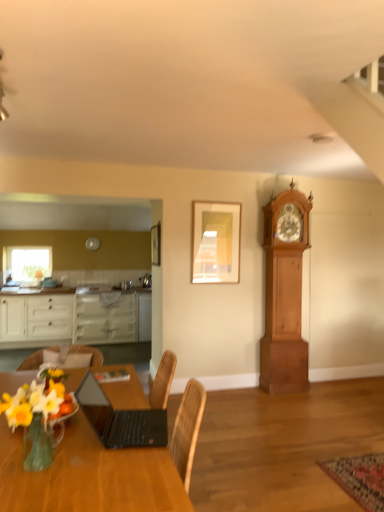
Question: Is matte gold picture frame at upper center, the second picture frame positioned from the left, at the right side of clear glass window at upper left?

Choices:
 (A) no
 (B) yes

Answer: (B)

Question: Does matte gold picture frame at upper center, arranged as the first picture frame when viewed from the right, have a smaller size compared to clear glass window at upper left?

Choices:
 (A) no
 (B) yes

Answer: (B)

Question: Can you confirm if matte gold picture frame at upper center, arranged as the first picture frame when viewed from the right, is bigger than clear glass window at upper left?

Choices:
 (A) no
 (B) yes

Answer: (A)

Question: Does matte gold picture frame at upper center, the second picture frame positioned from the left, have a greater height compared to clear glass window at upper left?

Choices:
 (A) yes
 (B) no

Answer: (A)

Question: Considering the relative positions of matte gold picture frame at upper center, arranged as the first picture frame when viewed from the right, and clear glass window at upper left in the image provided, is matte gold picture frame at upper center, arranged as the first picture frame when viewed from the right, in front of clear glass window at upper left?

Choices:
 (A) yes
 (B) no

Answer: (A)

Question: From a real-world perspective, is translucent glass vase at lower left physically located above or below wooden chair at lower left?

Choices:
 (A) below
 (B) above

Answer: (B)

Question: Is point (18, 394) positioned closer to the camera than point (26, 366)?

Choices:
 (A) closer
 (B) farther

Answer: (A)

Question: From the image's perspective, is translucent glass vase at lower left located above or below wooden chair at lower left?

Choices:
 (A) below
 (B) above

Answer: (B)

Question: Is translucent glass vase at lower left to the left or to the right of wooden chair at lower left in the image?

Choices:
 (A) right
 (B) left

Answer: (A)

Question: From their relative heights in the image, would you say clear glass window at upper left is taller or shorter than translucent glass vase at lower left?

Choices:
 (A) tall
 (B) short

Answer: (A)

Question: Is clear glass window at upper left situated inside translucent glass vase at lower left or outside?

Choices:
 (A) inside
 (B) outside

Answer: (B)

Question: Relative to translucent glass vase at lower left, is clear glass window at upper left in front or behind?

Choices:
 (A) front
 (B) behind

Answer: (B)

Question: Is clear glass window at upper left wider or thinner than translucent glass vase at lower left?

Choices:
 (A) thin
 (B) wide

Answer: (A)

Question: Is matte gold picture frame at upper center, arranged as the first picture frame when viewed from the right, taller or shorter than wooden chair at lower left?

Choices:
 (A) short
 (B) tall

Answer: (B)

Question: In terms of width, does matte gold picture frame at upper center, the second picture frame positioned from the left, look wider or thinner when compared to wooden chair at lower left?

Choices:
 (A) thin
 (B) wide

Answer: (A)